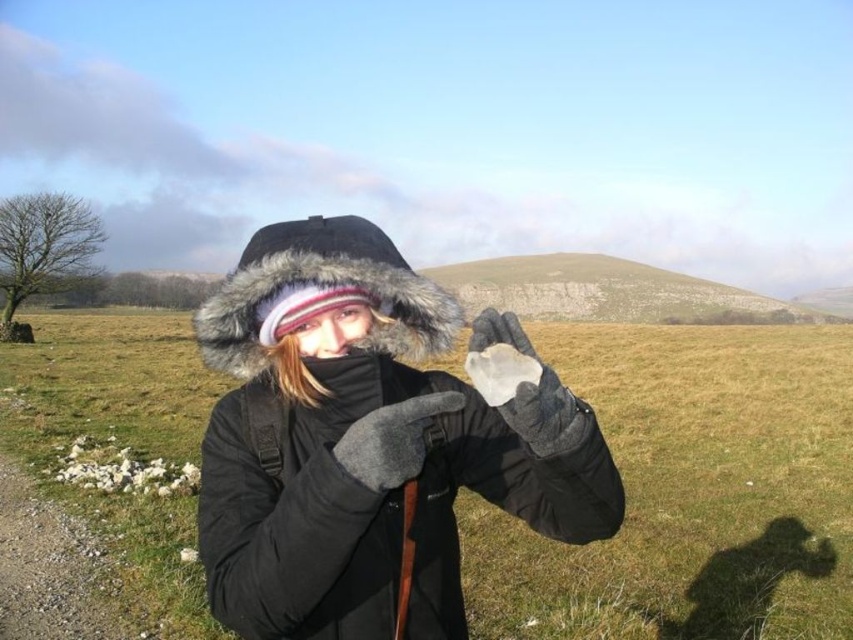
Based on the photo, can you confirm if fuzzy fur hat at center is bigger than gray fleece glove at center?

Yes, fuzzy fur hat at center is bigger than gray fleece glove at center.

Between fuzzy fur hat at center and gray fleece glove at center, which one is positioned higher?

fuzzy fur hat at center

Between point (312, 275) and point (421, 451), which one is positioned in front?

Point (421, 451)

Locate an element on the screen. This screenshot has width=853, height=640. fuzzy fur hat at center is located at coordinates (323, 291).

Does transparent glass rock at center have a greater width compared to black fuzzy jacket at center?

Correct, the width of transparent glass rock at center exceeds that of black fuzzy jacket at center.

Does transparent glass rock at center have a larger size compared to black fuzzy jacket at center?

Indeed, transparent glass rock at center has a larger size compared to black fuzzy jacket at center.

Find the location of a particular element. transparent glass rock at center is located at coordinates (689, 492).

Locate an element on the screen. The width and height of the screenshot is (853, 640). transparent glass rock at center is located at coordinates (689, 492).

Is the position of black fuzzy jacket at center more distant than that of translucent glass at center?

No, it is in front of translucent glass at center.

Does black fuzzy jacket at center have a smaller size compared to translucent glass at center?

Actually, black fuzzy jacket at center might be larger than translucent glass at center.

Which is behind, point (239, 458) or point (524, 371)?

Point (239, 458)

Locate an element on the screen. The image size is (853, 640). black fuzzy jacket at center is located at coordinates [x=370, y=504].